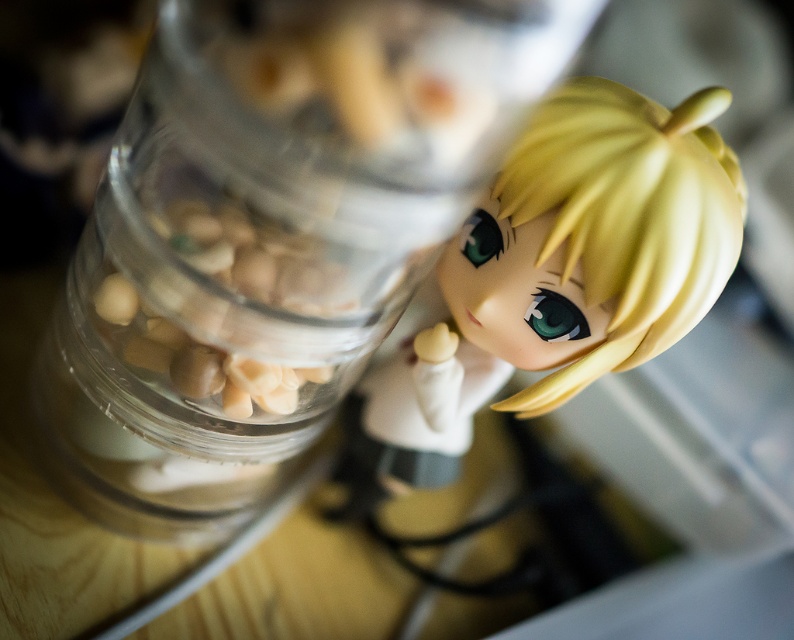
Question: Which point is closer to the camera taking this photo?

Choices:
 (A) (249, 230)
 (B) (175, 35)
 (C) (515, 172)

Answer: (B)

Question: Can you confirm if transparent glass jar at upper center is positioned to the left of satin blonde doll at upper right?

Choices:
 (A) yes
 (B) no

Answer: (A)

Question: Which of the following is the closest to the observer?

Choices:
 (A) translucent glass jar at upper left
 (B) satin blonde doll at upper right

Answer: (A)

Question: Is satin blonde doll at upper right bigger than translucent glass jar at upper left?

Choices:
 (A) no
 (B) yes

Answer: (B)

Question: Is satin blonde doll at upper right positioned before translucent glass jar at upper left?

Choices:
 (A) yes
 (B) no

Answer: (B)

Question: Which object is farther from the camera taking this photo?

Choices:
 (A) translucent glass jar at upper left
 (B) transparent glass jar at upper center

Answer: (A)